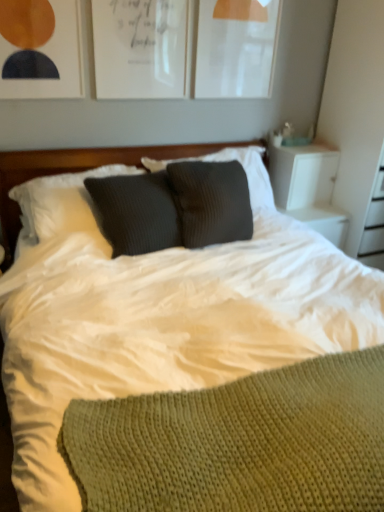
Question: Should I look upward or downward to see matte white picture frame at upper left, which is the 1th picture frame in left-to-right order?

Choices:
 (A) down
 (B) up

Answer: (B)

Question: In which direction should I rotate to look at white paper at upper center, which is the 2th picture frame in left-to-right order?

Choices:
 (A) left
 (B) right

Answer: (A)

Question: Does matte white picture frame at upper left, which is the 1th picture frame in left-to-right order, appear on the right side of woolen dark gray pillow at center?

Choices:
 (A) no
 (B) yes

Answer: (A)

Question: Does matte white picture frame at upper left, which ranks as the third picture frame in right-to-left order, have a larger size compared to woolen dark gray pillow at center?

Choices:
 (A) yes
 (B) no

Answer: (B)

Question: Does matte white picture frame at upper left, which is the 1th picture frame in left-to-right order, have a smaller size compared to woolen dark gray pillow at center?

Choices:
 (A) yes
 (B) no

Answer: (A)

Question: Would you say woolen dark gray pillow at center is part of matte white picture frame at upper left, which ranks as the third picture frame in right-to-left order,'s contents?

Choices:
 (A) no
 (B) yes

Answer: (A)

Question: From a real-world perspective, does matte white picture frame at upper left, which is the 1th picture frame in left-to-right order, sit lower than woolen dark gray pillow at center?

Choices:
 (A) no
 (B) yes

Answer: (A)

Question: Is matte white picture frame at upper center, which is the 1th picture frame from right to left, looking in the opposite direction of white soft bedding at center?

Choices:
 (A) no
 (B) yes

Answer: (A)

Question: Can you confirm if matte white picture frame at upper center, the 3th picture frame viewed from the left, is shorter than white soft bedding at center?

Choices:
 (A) yes
 (B) no

Answer: (A)

Question: Are matte white picture frame at upper center, the 3th picture frame viewed from the left, and white soft bedding at center located far from each other?

Choices:
 (A) no
 (B) yes

Answer: (B)

Question: Can you confirm if matte white picture frame at upper center, the 3th picture frame viewed from the left, is bigger than white soft bedding at center?

Choices:
 (A) yes
 (B) no

Answer: (B)

Question: Is white soft bedding at center completely or partially inside matte white picture frame at upper center, the 3th picture frame viewed from the left?

Choices:
 (A) no
 (B) yes

Answer: (A)

Question: Is matte white picture frame at upper center, the 3th picture frame viewed from the left, facing towards white soft bedding at center?

Choices:
 (A) yes
 (B) no

Answer: (B)

Question: Is woolen dark gray pillow at center far away from white soft bedding at center?

Choices:
 (A) no
 (B) yes

Answer: (A)